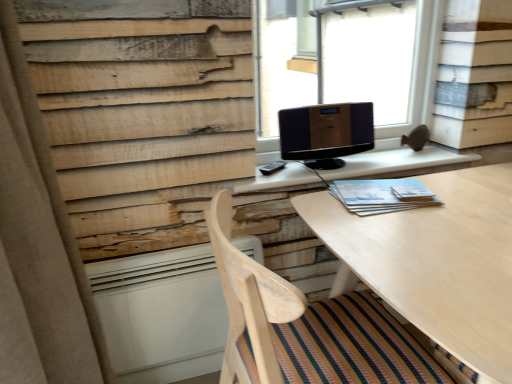
The image size is (512, 384). I want to click on free space above white matte radiator at lower left (from a real-world perspective), so click(x=156, y=241).